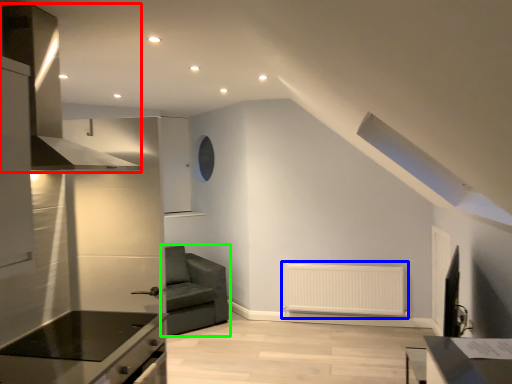
Question: Which object is positioned farthest from exhaust hood (highlighted by a red box)? Select from radiator (highlighted by a blue box) and studio couch (highlighted by a green box).

Choices:
 (A) radiator
 (B) studio couch

Answer: (A)